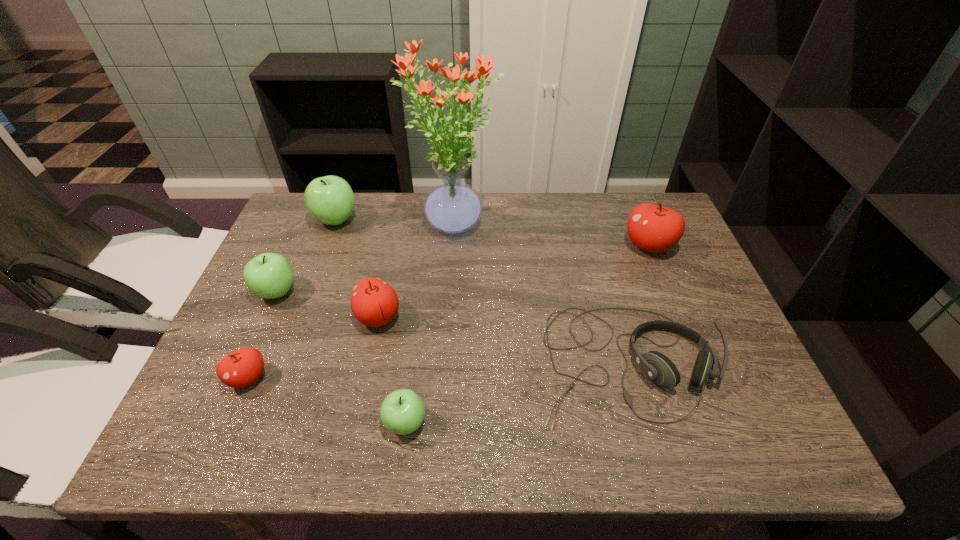
Choose which red apple is the nearest neighbor to the nearest green apple. Please provide its 2D coordinates. Your answer should be formatted as a tuple, i.e. [(x, y)], where the tuple contains the x and y coordinates of a point satisfying the conditions above.

[(374, 303)]

You are a GUI agent. You are given a task and a screenshot of the screen. Output one action in this format:
    pyautogui.click(x=<x>, y=<y>)
    Task: Click on the third closest green apple to the second nearest red apple
    
    Given the screenshot: What is the action you would take?
    pyautogui.click(x=330, y=199)

Locate which green apple is the closest to the second farthest green apple. Please provide its 2D coordinates. Your answer should be formatted as a tuple, i.e. [(x, y)], where the tuple contains the x and y coordinates of a point satisfying the conditions above.

[(330, 199)]

Where is `free location that satisfies the following two spatial constraints: 1. on the front side of the smallest green apple; 2. on the right side of the second nearest red apple`? The height and width of the screenshot is (540, 960). free location that satisfies the following two spatial constraints: 1. on the front side of the smallest green apple; 2. on the right side of the second nearest red apple is located at coordinates (356, 423).